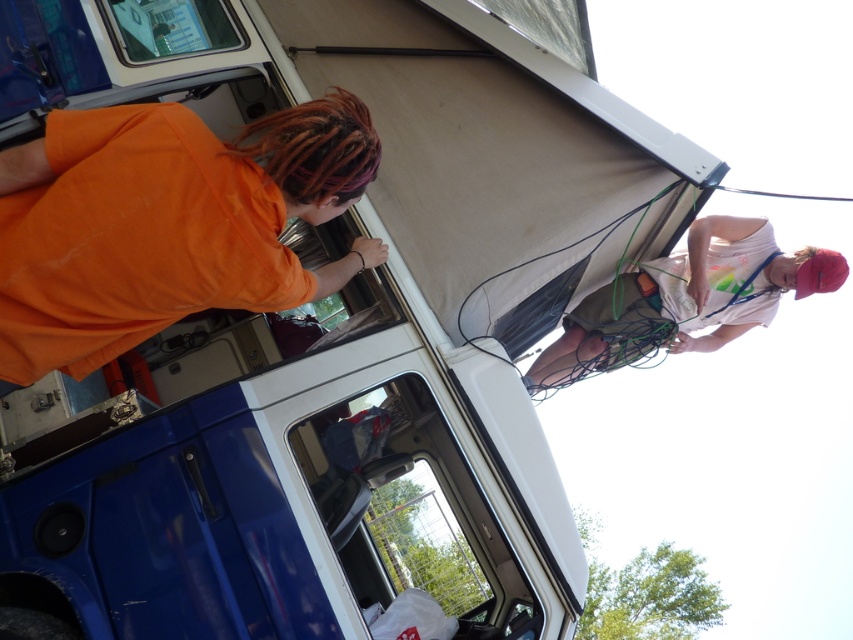
You are a photographer trying to capture both the orange cotton shirt at left and the white cotton shirt at upper right in a single frame. However, due to the camera lens limitations, you can only focus on one subject at a time. Which subject should you focus on to ensure the other remains in the background?

You should focus on the orange cotton shirt at left because it is in front of the white cotton shirt at upper right, so the white cotton shirt at upper right will naturally be in the background.

You are planning to take a photo of the orange cotton shirt at left and the white cotton shirt at upper right. Since you want both shirts to be clearly visible in the photo, which shirt should you focus on first to ensure proper focus, considering their sizes in the frame?

The orange cotton shirt at left has a greater height compared to the white cotton shirt at upper right, so you should focus on the orange cotton shirt at left first to ensure proper focus, as it is larger in the frame.

You are a photographer trying to capture both the orange cotton shirt at left and the white cotton shirt at upper right in a single frame. Based on their positions, which shirt would appear closer to the bottom of your photo?

The orange cotton shirt at left would appear closer to the bottom of the photo since it is located above the white cotton shirt at upper right, meaning it is positioned lower in the frame.